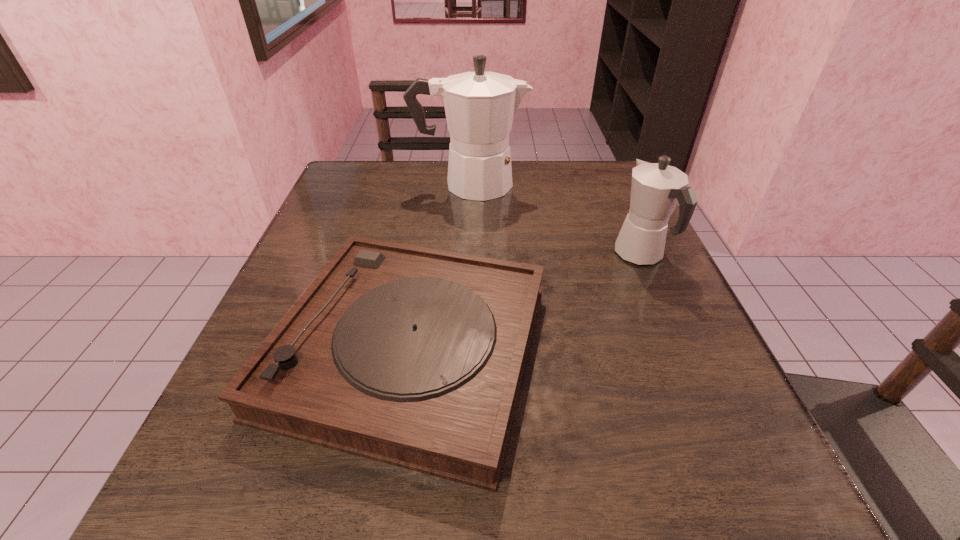
Identify which object is the second closest to the taller coffeepot. Please provide its 2D coordinates. Your answer should be formatted as a tuple, i.e. [(x, y)], where the tuple contains the x and y coordinates of a point satisfying the conditions above.

[(411, 356)]

Find the location of a particular element. Image resolution: width=960 pixels, height=540 pixels. vacant position in the image that satisfies the following two spatial constraints: 1. at the spout of the farther coffeepot; 2. on the right side of the second shortest object is located at coordinates (467, 255).

Find the location of a particular element. The image size is (960, 540). free space that satisfies the following two spatial constraints: 1. at the spout of the taller coffeepot; 2. on the back side of the second shortest object is located at coordinates (467, 255).

Locate an element on the screen. This screenshot has width=960, height=540. vacant region that satisfies the following two spatial constraints: 1. at the spout of the left coffeepot; 2. on the front side of the phonograph record is located at coordinates (463, 349).

Image resolution: width=960 pixels, height=540 pixels. Identify the location of free spot that satisfies the following two spatial constraints: 1. on the back side of the shortest object; 2. on the left side of the shorter coffeepot. [424, 255].

Identify the location of vacant space that satisfies the following two spatial constraints: 1. at the spout of the second tallest object; 2. on the right side of the taller coffeepot. Image resolution: width=960 pixels, height=540 pixels. (467, 255).